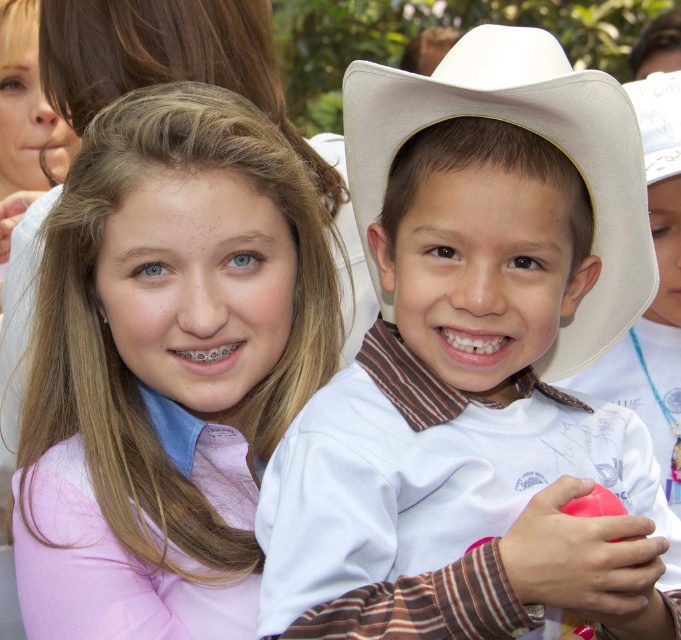
Question: Does white felt cowboy hat at center appear over white cotton cowboy hat at center?

Choices:
 (A) no
 (B) yes

Answer: (B)

Question: Is white matte cowboy hat at upper right thinner than white felt cowboy hat at center?

Choices:
 (A) no
 (B) yes

Answer: (A)

Question: Is white felt cowboy hat at center below white cotton cowboy hat at center?

Choices:
 (A) no
 (B) yes

Answer: (A)

Question: Estimate the real-world distances between objects in this image. Which object is closer to the white felt cowboy hat at center?

Choices:
 (A) white cotton cowboy hat at center
 (B) white matte cowboy hat at upper right
 (C) pink fabric shirt at upper left

Answer: (B)

Question: Which point appears farthest from the camera in this image?

Choices:
 (A) click(97, 236)
 (B) click(633, 307)
 (C) click(646, 92)

Answer: (C)

Question: Which is farther from the pink fabric shirt at upper left?

Choices:
 (A) white matte cowboy hat at upper right
 (B) white felt cowboy hat at center

Answer: (B)